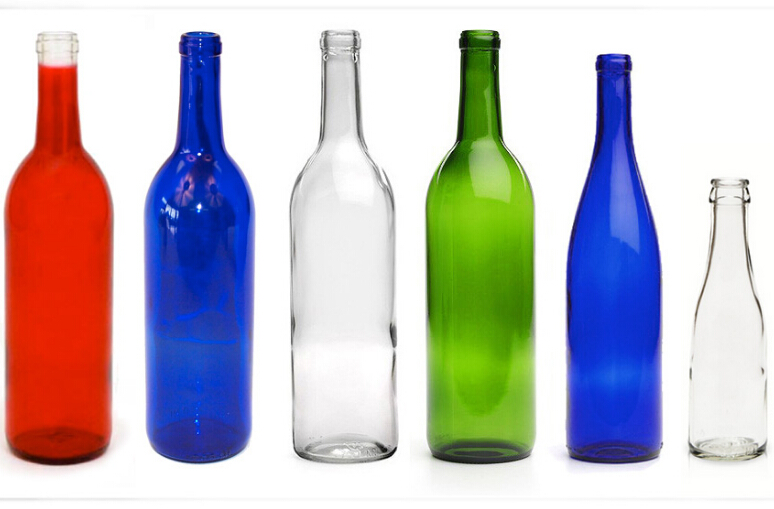
Where is `bottle`? The height and width of the screenshot is (509, 774). bottle is located at coordinates (724, 315), (620, 313), (491, 292), (362, 273), (168, 268), (80, 266).